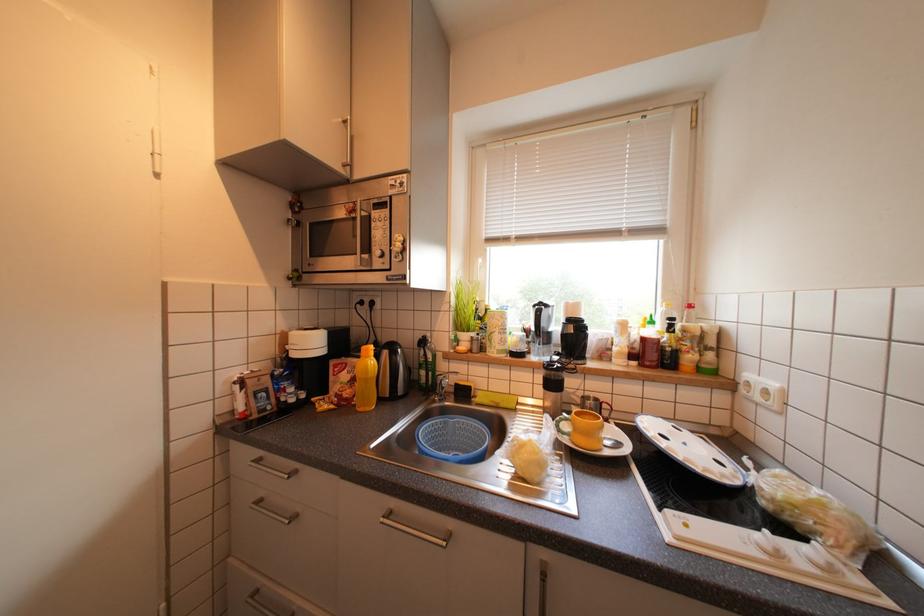
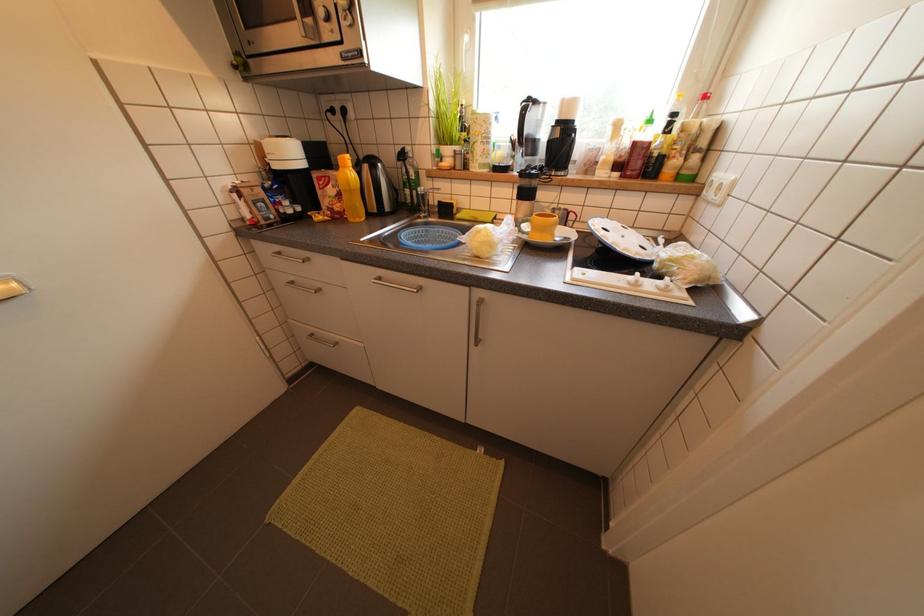
Question: The images are taken continuously from a first-person perspective. In which direction is your viewpoint rotating?

Choices:
 (A) Left
 (B) Right
 (C) Up
 (D) Down

Answer: (D)